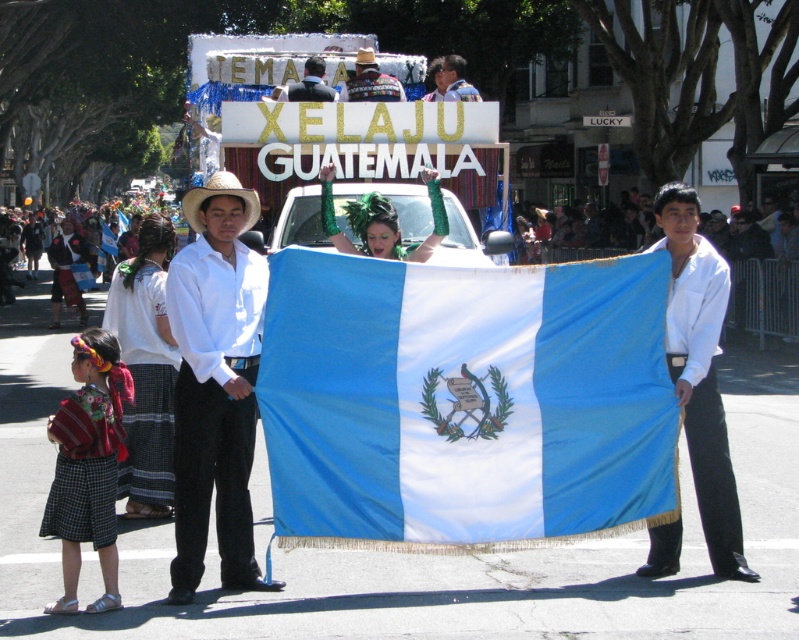
You are a photographer at the front of the parade. You want to capture a photo where both the blue fabric flag at center and the white smooth shirt at center are visible. Based on their positions, which object should appear higher in the photo?

The white smooth shirt at center appears higher in the photo because the blue fabric flag at center is positioned below it.

You are a photographer at the Guatemalan parade. You want to capture a photo of the blue fabric flag at center without any obstructions. Since the strawhat at left is in the way, can you move to the right side to take the photo?

The blue fabric flag at center is positioned under strawhat at left, so moving to the right side would allow you to take the photo without the strawhat at left obstructing the view.

From the picture: You are a photographer at the Guatemalan parade and want to capture the blue fabric flag at center in your shot. The flag is located at point (x=464, y=401). You need to adjust your camera to focus on this point. What coordinates should you set your camera to?

The blue fabric flag at center is located at point (x=464, y=401), so you should set your camera to focus on coordinates (x=464, y=401).